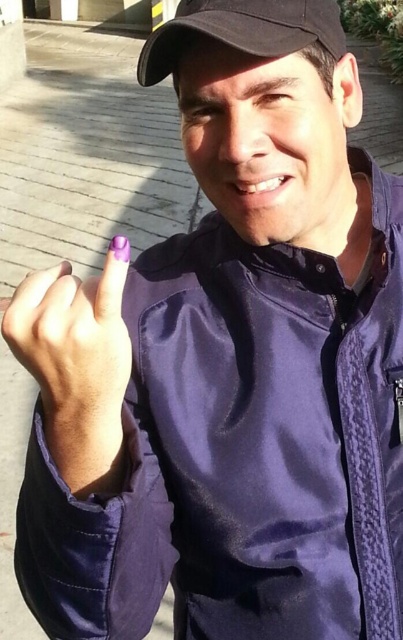
Question: Which point is farther from the camera taking this photo?

Choices:
 (A) (105, 339)
 (B) (211, 32)

Answer: (B)

Question: Which point is farther to the camera?

Choices:
 (A) (45, 340)
 (B) (247, 20)

Answer: (B)

Question: Can you confirm if purple painted nail at center is thinner than black matte baseball cap at upper center?

Choices:
 (A) yes
 (B) no

Answer: (A)

Question: Is purple painted nail at center bigger than black matte baseball cap at upper center?

Choices:
 (A) yes
 (B) no

Answer: (B)

Question: Where is purple painted nail at center located in relation to black matte baseball cap at upper center in the image?

Choices:
 (A) right
 (B) left

Answer: (B)